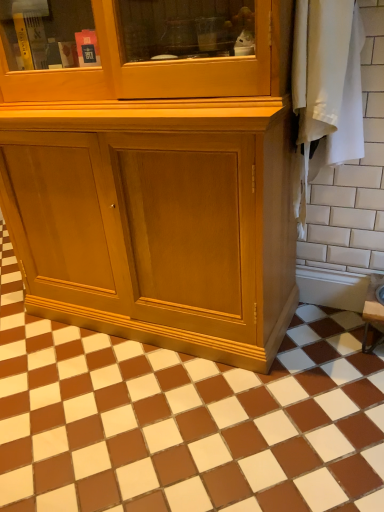
Question: Visually, is brown glossy tile at center, the second ceramic tile in the right-to-left sequence, positioned to the left or to the right of white ceramic tile at right, which is the second ceramic tile in bottom-to-top order?

Choices:
 (A) right
 (B) left

Answer: (B)

Question: Considering their positions, is brown glossy tile at center, which appears as the second ceramic tile when viewed from the top, located in front of or behind white ceramic tile at right, the 1th ceramic tile viewed from the right?

Choices:
 (A) front
 (B) behind

Answer: (A)

Question: From a real-world perspective, is brown glossy tile at center, the 1th ceramic tile positioned from the left, above or below white ceramic tile at right, acting as the 1th ceramic tile starting from the top?

Choices:
 (A) below
 (B) above

Answer: (A)

Question: Looking at the image, does white ceramic tile at right, which is the second ceramic tile from left to right, seem bigger or smaller compared to brown glossy tile at center, which appears as the second ceramic tile when viewed from the top?

Choices:
 (A) small
 (B) big

Answer: (A)

Question: Relative to brown glossy tile at center, the 1th ceramic tile positioned from the left, is white ceramic tile at right, the 1th ceramic tile viewed from the right, in front or behind?

Choices:
 (A) behind
 (B) front

Answer: (A)

Question: From a real-world perspective, is white ceramic tile at right, acting as the 1th ceramic tile starting from the top, positioned above or below brown glossy tile at center, which appears as the second ceramic tile when viewed from the top?

Choices:
 (A) below
 (B) above

Answer: (B)

Question: Looking at their shapes, would you say white ceramic tile at right, the 1th ceramic tile viewed from the right, is wider or thinner than brown glossy tile at center, the second ceramic tile in the right-to-left sequence?

Choices:
 (A) wide
 (B) thin

Answer: (B)